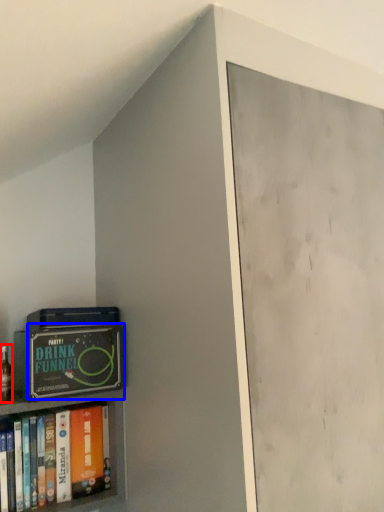
Question: Which of the following is the farthest to the observer, alcohol (highlighted by a red box) or paperback book (highlighted by a blue box)?

Choices:
 (A) alcohol
 (B) paperback book

Answer: (A)